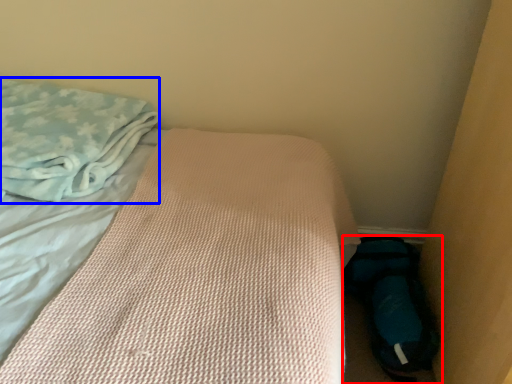
Question: Which of the following is the closest to the observer, footwear (highlighted by a red box) or cloth (highlighted by a blue box)?

Choices:
 (A) footwear
 (B) cloth

Answer: (B)